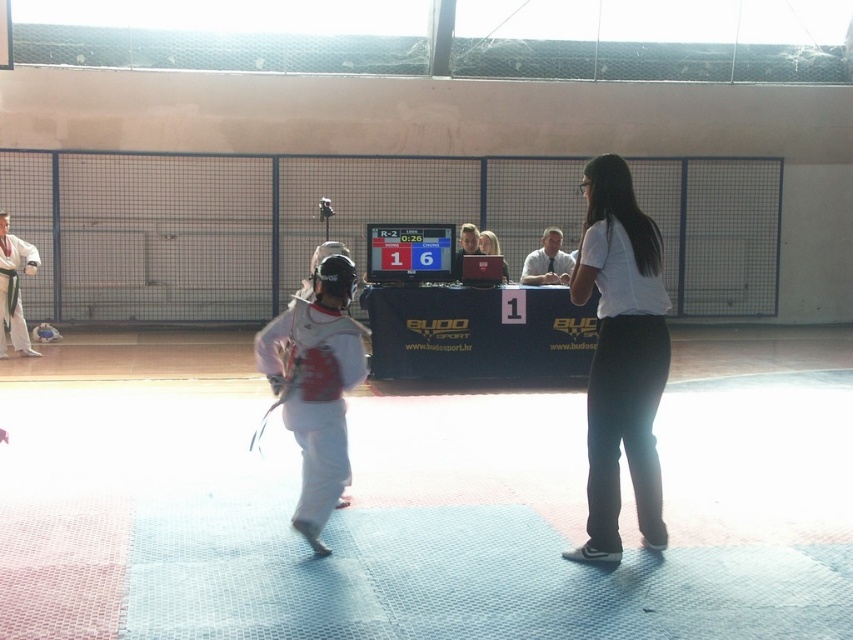
You are a referee at the martial arts competition. You need to determine which competitor is closer to the center of the mat. The competitors are wearing the white matte shirt at center and the matte white shirt at center. Based on their positions, which one is positioned closer to the center?

The white matte shirt at center is below matte white shirt at center, so the white matte shirt at center is closer to the center of the mat.

You are a photographer positioned at the back of the competition area. You need to take a photo that includes both the white matte shirt at center and the matte white shirt at center. Since you want to emphasize the smaller one, which one should you focus on framing closer to the camera?

You should focus on framing the matte white shirt at center closer to the camera because it is smaller than the white matte shirt at center, making it appear larger in the photo and emphasizing it.